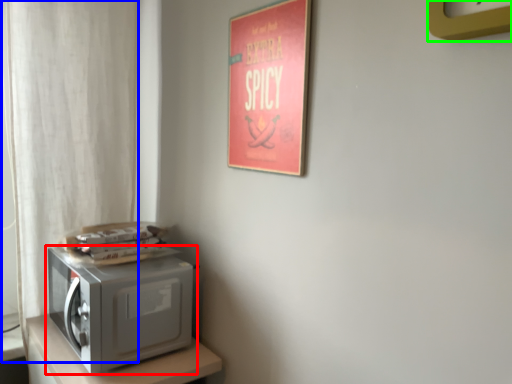
Question: Estimate the real-world distances between objects in this image. Which object is farther from home appliance (highlighted by a red box), curtain (highlighted by a blue box) or clock (highlighted by a green box)?

Choices:
 (A) curtain
 (B) clock

Answer: (B)